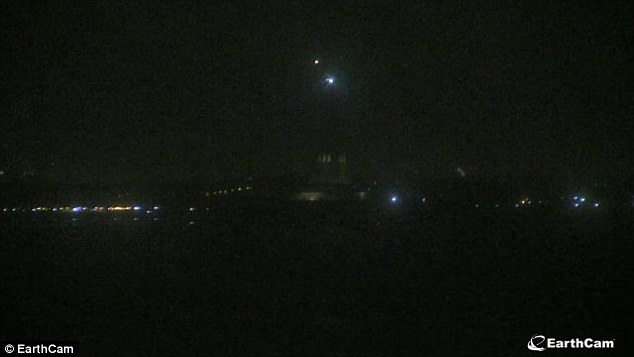
The image size is (634, 357). What are the coordinates of `windows filled with lights` in the screenshot? It's located at (87, 218).